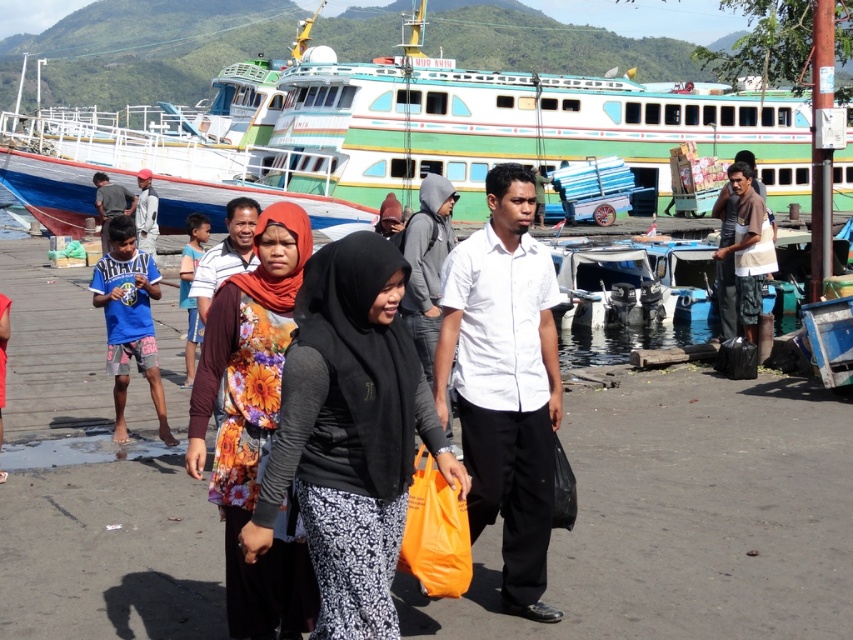
You are standing on the wooden pier and want to move from point A to point B. Point A is at coordinate point(254, 376) and point B is at coordinate point(747, 324). Which point is closer to you when you start?

Point A at coordinate point(254, 376) is closer to you than point B at coordinate point(747, 324).

You are standing at the lower left corner of the image. You want to walk towards the green painted wooden boat at upper center. Which direction should you move first?

To reach the green painted wooden boat at upper center from the lower left corner, you should move northeast first, as the boat is located at coordinates approximately 0.212 on the x and 0.468 on the y axis.

You are standing at the edge of the wooden pier in the harbor scene. There are two points marked in the image. Which point, point (374,552) or point (747,298), is closer to you?

Point (374,552) is closer to the camera than point (747,298), so it is closer to you.